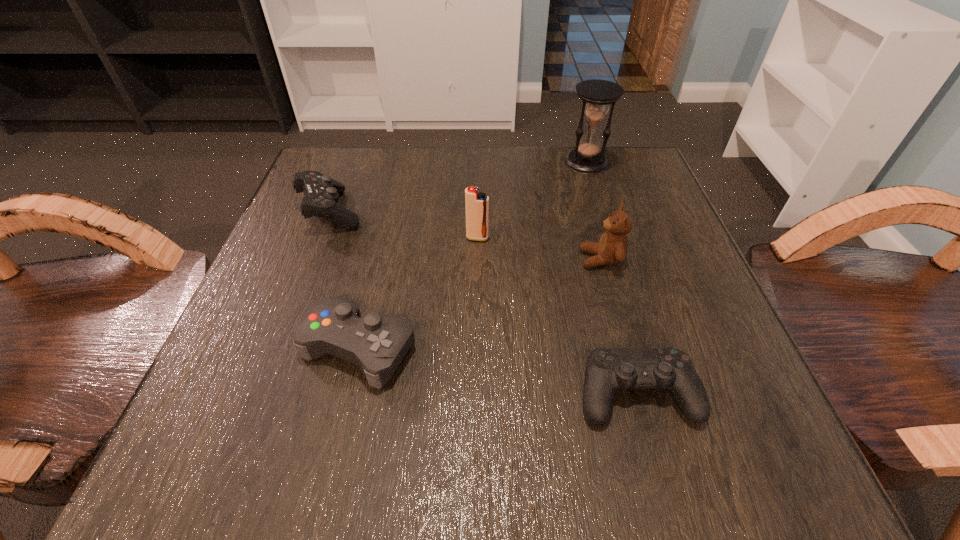
Where is `the farthest object`? the farthest object is located at coordinates (596, 95).

Where is `the tallest object`? Image resolution: width=960 pixels, height=540 pixels. the tallest object is located at coordinates (596, 95).

This screenshot has height=540, width=960. I want to click on teddy bear, so click(x=612, y=248).

Where is `igniter`? Image resolution: width=960 pixels, height=540 pixels. igniter is located at coordinates (476, 203).

Locate an element on the screen. This screenshot has height=540, width=960. the farthest control is located at coordinates (321, 192).

Identify the location of the rightmost control. (607, 370).

Where is `vacant region located 0.080m on the right of the farthest object`? Image resolution: width=960 pixels, height=540 pixels. vacant region located 0.080m on the right of the farthest object is located at coordinates (642, 163).

Locate an element on the screen. The height and width of the screenshot is (540, 960). vacant space located 0.050m at the face of the teddy bear is located at coordinates (552, 259).

At what (x,y) coordinates should I click in order to perform the action: click on free space located at the face of the teddy bear. Please return your answer as a coordinate pair (x, y). This screenshot has height=540, width=960. Looking at the image, I should click on (352, 259).

In order to click on blank area located at the face of the teddy bear in this screenshot , I will do `click(455, 259)`.